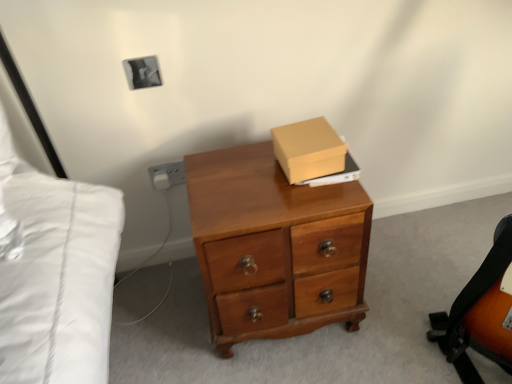
I want to click on vacant space that is in between wooden desk at center and orange leather messenger bag at lower right, so click(x=366, y=331).